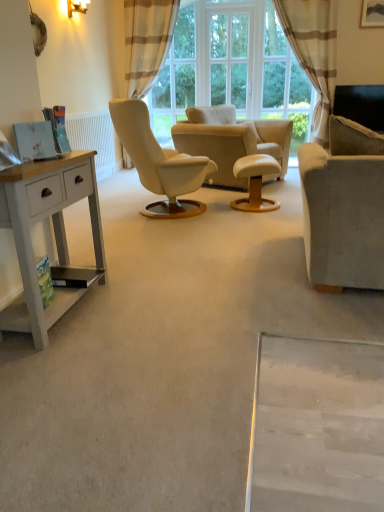
Find the location of `unoccupied region to the right of white painted wood desk at left`. unoccupied region to the right of white painted wood desk at left is located at coordinates (149, 312).